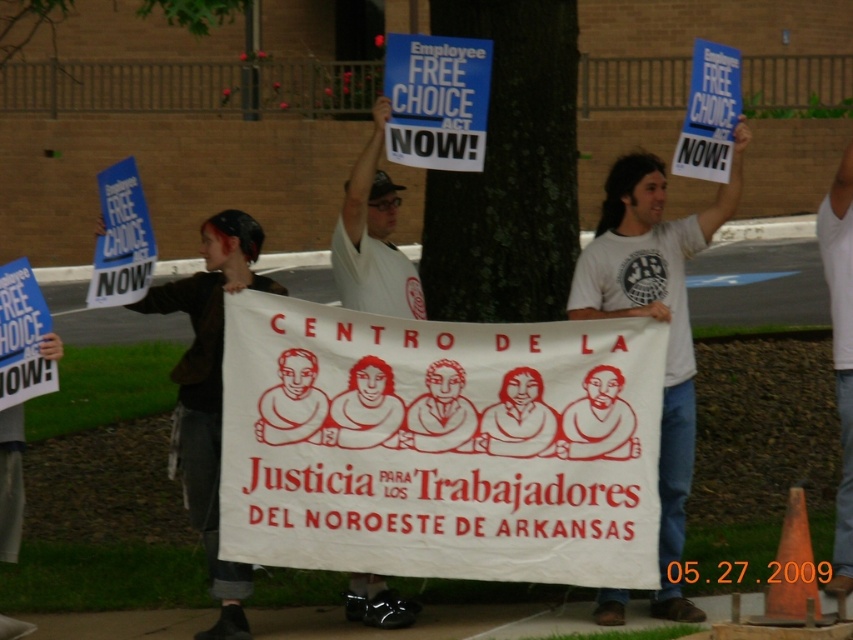
You are a photographer trying to capture a clear shot of the white cotton shirt at center and the blue paper sign at upper center. Which object should you focus on first to ensure both are in frame?

The white cotton shirt at center is positioned on the left side of the blue paper sign at upper center. Focus on the white cotton shirt at center first to ensure both are in frame since it is positioned to the left of the sign.